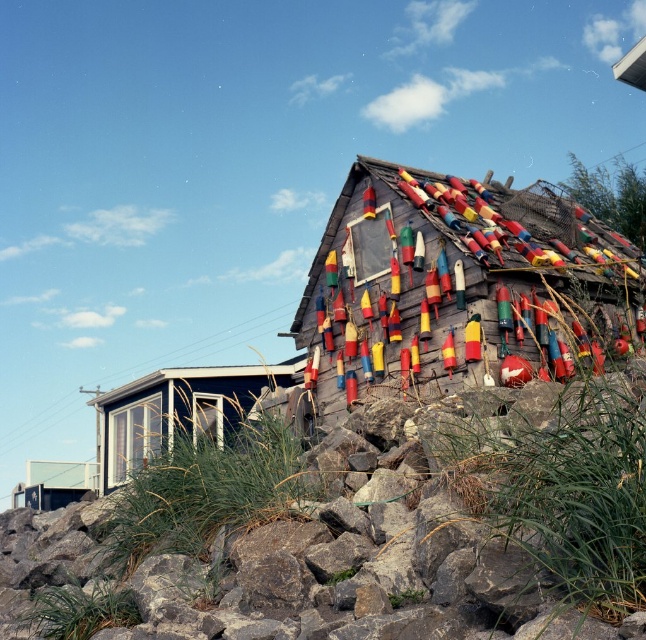
Question: Which point is closer to the camera taking this photo?

Choices:
 (A) (140, 385)
 (B) (351, 284)

Answer: (B)

Question: Which point appears closest to the camera in this image?

Choices:
 (A) (348, 365)
 (B) (298, 360)

Answer: (A)

Question: Is wooden buoys at upper right to the right of matte black cabin at lower left from the viewer's perspective?

Choices:
 (A) yes
 (B) no

Answer: (A)

Question: Is wooden buoys at upper right wider than matte black cabin at lower left?

Choices:
 (A) yes
 (B) no

Answer: (A)

Question: Which point appears closest to the camera in this image?

Choices:
 (A) (446, 253)
 (B) (255, 384)

Answer: (A)

Question: Is wooden buoys at upper right above matte black cabin at lower left?

Choices:
 (A) no
 (B) yes

Answer: (B)